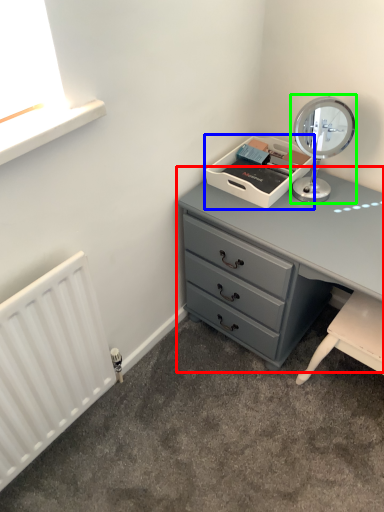
Question: Estimate the real-world distances between objects in this image. Which object is farther from chest of drawers (highlighted by a red box), printer (highlighted by a blue box) or table lamp (highlighted by a green box)?

Choices:
 (A) printer
 (B) table lamp

Answer: (B)